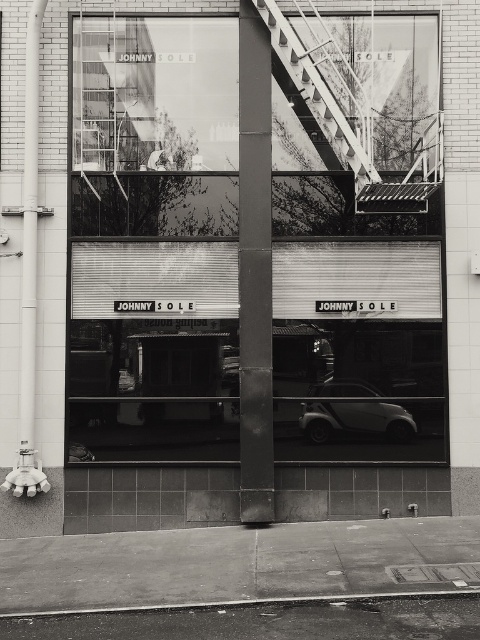
Question: Which point is closer to the camera?

Choices:
 (A) transparent glass window at upper center
 (B) smooth concrete pillar at center
 (C) smooth concrete curb at lower center

Answer: (C)

Question: Is white smooth pipe at left wider than smooth concrete curb at lower center?

Choices:
 (A) no
 (B) yes

Answer: (A)

Question: Is smooth concrete pillar at center in front of metallic staircase at upper center?

Choices:
 (A) no
 (B) yes

Answer: (A)

Question: Which point is farther to the camera?

Choices:
 (A) metallic staircase at upper center
 (B) transparent glass window at upper center

Answer: (B)

Question: Is shiny black car at lower right above smooth concrete curb at lower center?

Choices:
 (A) no
 (B) yes

Answer: (B)

Question: Considering the real-world distances, which object is closest to the smooth concrete pillar at center?

Choices:
 (A) white smooth pipe at left
 (B) smooth concrete curb at lower center
 (C) shiny black car at lower right

Answer: (C)